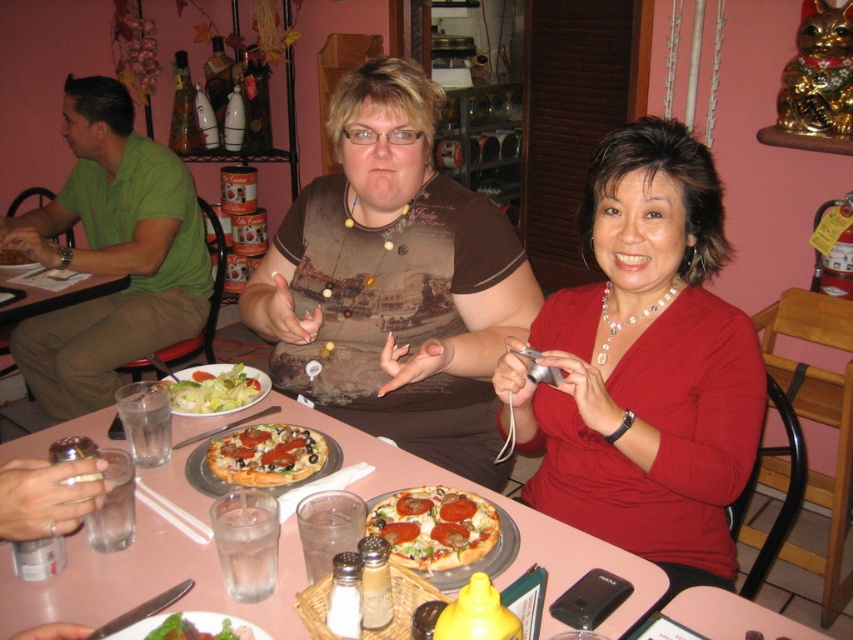
Question: Estimate the real-world distances between objects in this image. Which object is farther from the green leafy salad at center?

Choices:
 (A) green leafy salad at lower left
 (B) green cotton shirt at left
 (C) golden crispy pizza at center
 (D) pearl necklace at upper right

Answer: (B)

Question: Which object is positioned farthest from the golden crispy pizza at center?

Choices:
 (A) green leafy salad at center
 (B) pink plastic table at center

Answer: (A)

Question: Is green cotton shirt at left closer to the viewer compared to pepperoni-topped pizza at center?

Choices:
 (A) no
 (B) yes

Answer: (A)

Question: Is golden crispy pizza at center to the right of green leafy salad at lower left from the viewer's perspective?

Choices:
 (A) no
 (B) yes

Answer: (A)

Question: Does green leafy salad at center have a larger size compared to green leafy salad at lower left?

Choices:
 (A) yes
 (B) no

Answer: (A)

Question: Estimate the real-world distances between objects in this image. Which object is closer to the pepperoni-topped pizza at center?

Choices:
 (A) golden crispy pizza at center
 (B) pink plastic table at center

Answer: (B)